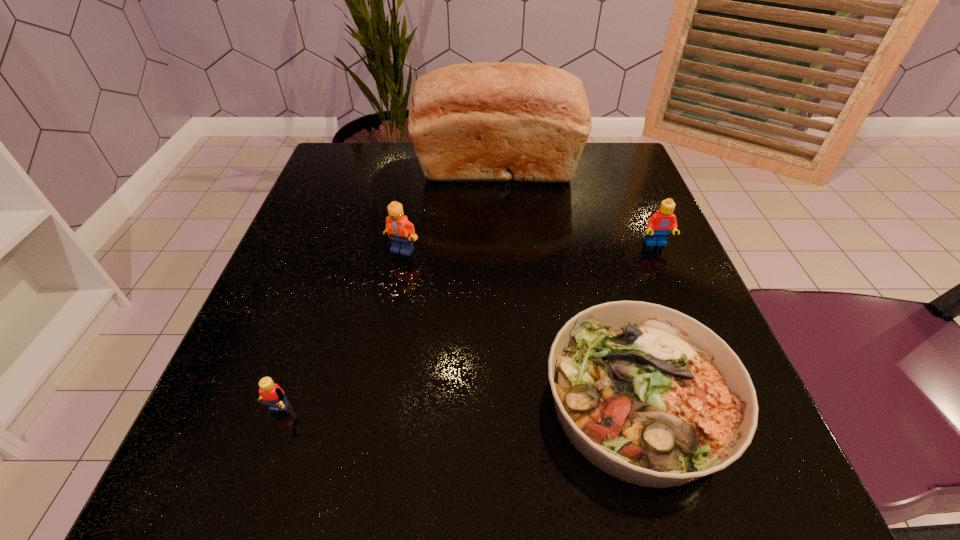
Identify which Lego is the closest to the rightmost Lego. Please provide its 2D coordinates. Your answer should be formatted as a tuple, i.e. [(x, y)], where the tuple contains the x and y coordinates of a point satisfying the conditions above.

[(401, 231)]

The height and width of the screenshot is (540, 960). What are the coordinates of `Lego object that ranks as the closest to the rightmost Lego` in the screenshot? It's located at (401, 231).

You are a GUI agent. You are given a task and a screenshot of the screen. Output one action in this format:
    pyautogui.click(x=<x>, y=<y>)
    Task: Click on the free region that satisfies the following two spatial constraints: 1. on the front-facing side of the salad plate; 2. on the right side of the second Lego from right to left
    Image resolution: width=960 pixels, height=540 pixels.
    Given the screenshot: What is the action you would take?
    pyautogui.click(x=374, y=403)

Image resolution: width=960 pixels, height=540 pixels. In order to click on blank space that satisfies the following two spatial constraints: 1. on the front-facing side of the second Lego from left to right; 2. on the left side of the shortest object in this screenshot , I will do `click(374, 403)`.